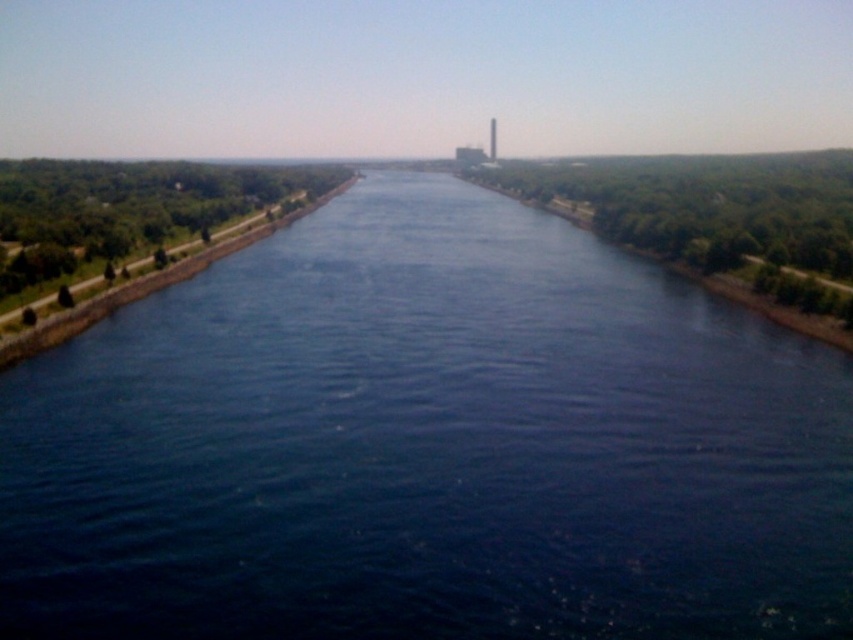
Question: Which point is farther to the camera?

Choices:
 (A) (495, 150)
 (B) (233, 528)

Answer: (A)

Question: Is the position of dark blue water at center more distant than that of smooth gray tower at center?

Choices:
 (A) yes
 (B) no

Answer: (B)

Question: Does dark blue water at center have a larger size compared to smooth gray tower at center?

Choices:
 (A) yes
 (B) no

Answer: (A)

Question: Among these objects, which one is nearest to the camera?

Choices:
 (A) dark blue water at center
 (B) smooth gray tower at center

Answer: (A)

Question: Does dark blue water at center lie in front of smooth gray tower at center?

Choices:
 (A) no
 (B) yes

Answer: (B)

Question: Which object is closer to the camera taking this photo?

Choices:
 (A) smooth gray tower at center
 (B) dark blue water at center

Answer: (B)